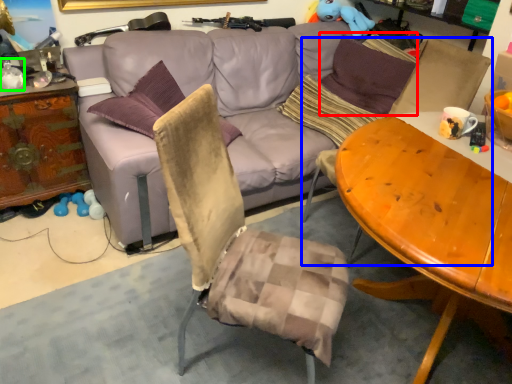
Question: Which object is the farthest from pillow (highlighted by a red box)? Choose among these: swivel chair (highlighted by a blue box) or bottle (highlighted by a green box).

Choices:
 (A) swivel chair
 (B) bottle

Answer: (B)